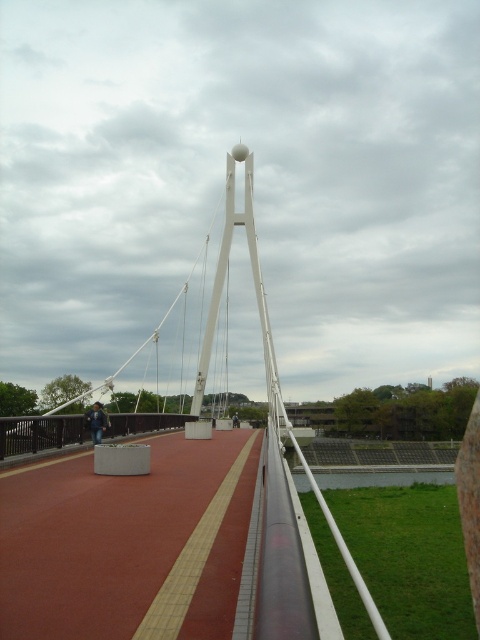
Question: Where is white metallic suspension bridge at center located in relation to dark blue jeans at left in the image?

Choices:
 (A) above
 (B) below

Answer: (A)

Question: Among these objects, which one is farthest from the camera?

Choices:
 (A) red rubber path at center
 (B) white metallic suspension bridge at center
 (C) dark blue jeans at left

Answer: (C)

Question: Observing the image, what is the correct spatial positioning of white metallic suspension bridge at center in reference to dark blue jeans at left?

Choices:
 (A) right
 (B) left

Answer: (A)

Question: Can you confirm if matte gray concrete bridge at center is positioned above dark blue jeans at left?

Choices:
 (A) no
 (B) yes

Answer: (A)

Question: Which point appears farthest from the camera in this image?

Choices:
 (A) click(99, 538)
 (B) click(81, 621)
 (C) click(166, 417)

Answer: (C)

Question: Which point appears farthest from the camera in this image?

Choices:
 (A) (108, 512)
 (B) (168, 598)
 (C) (93, 413)
 (D) (118, 417)

Answer: (D)